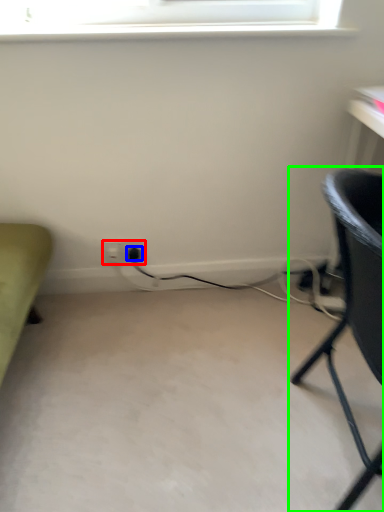
Question: Which object is positioned farthest from electric outlet (highlighted by a red box)? Select from plug (highlighted by a blue box) and chair (highlighted by a green box).

Choices:
 (A) plug
 (B) chair

Answer: (B)